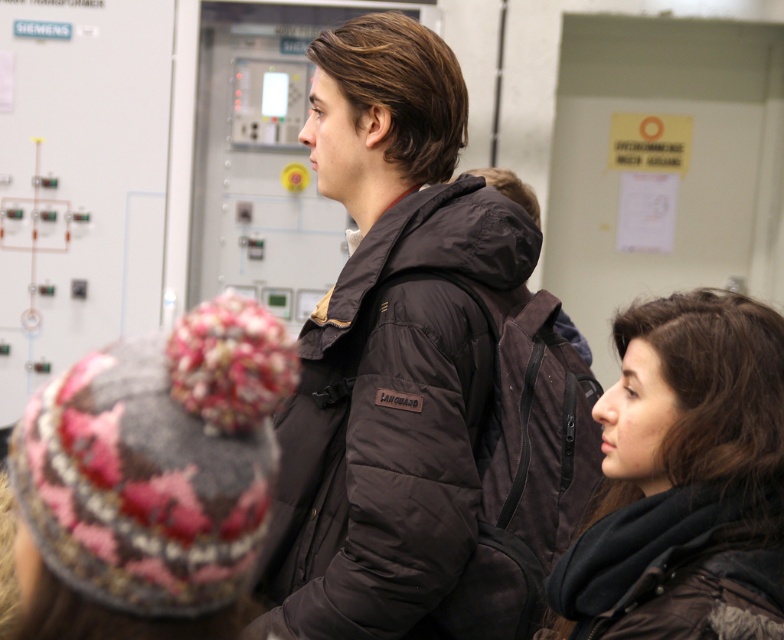
You are standing in an industrial control room and see the dark brown puffer jacket at center. If you need to hand a tool to the person wearing it without moving closer than 5 feet, will you be able to reach them?

The distance between you and the dark brown puffer jacket at center is 4.89 feet, which is less than 5 feet. Therefore, you can reach them without moving closer than 5 feet.

You are a security guard in the control room and need to check the distance between the dark brown puffer jacket at center and the dark brown hair at center. Can you confirm if the distance is more than 18 inches?

The distance between the dark brown puffer jacket at center and the dark brown hair at center is 18.59 inches, which is just over 18 inches. Yes, the distance is more than 18 inches.